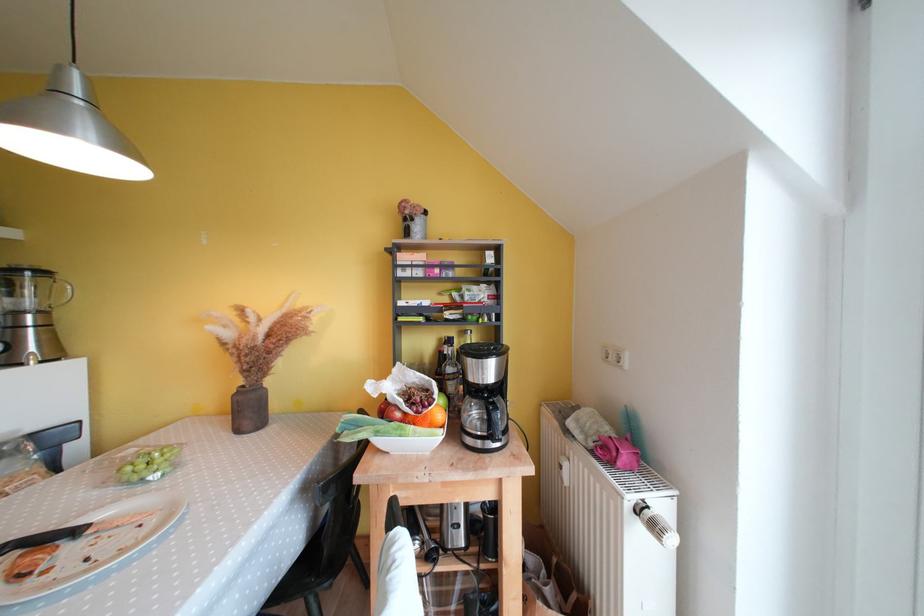
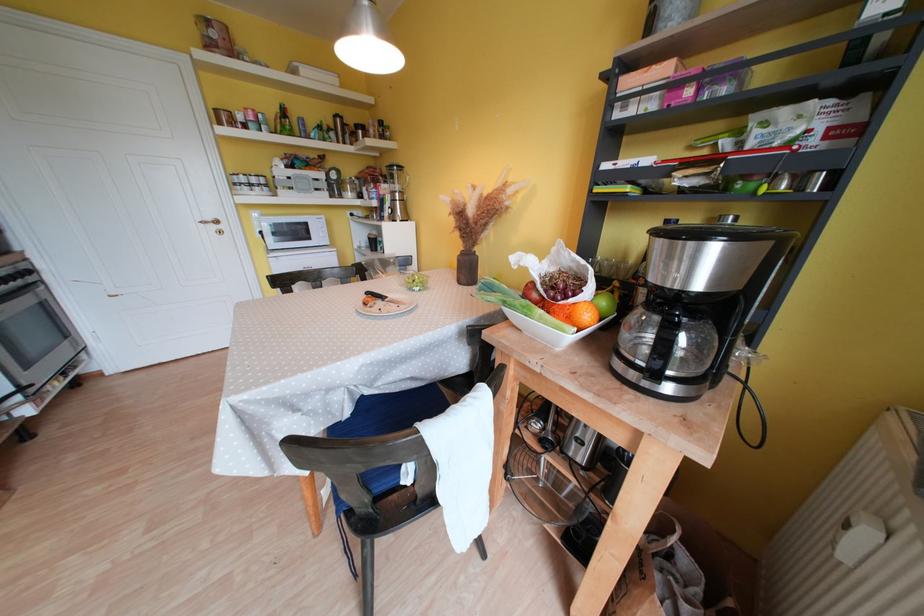
In the second image, find the point that corresponds to point 455,341 in the first image.

(673, 224)